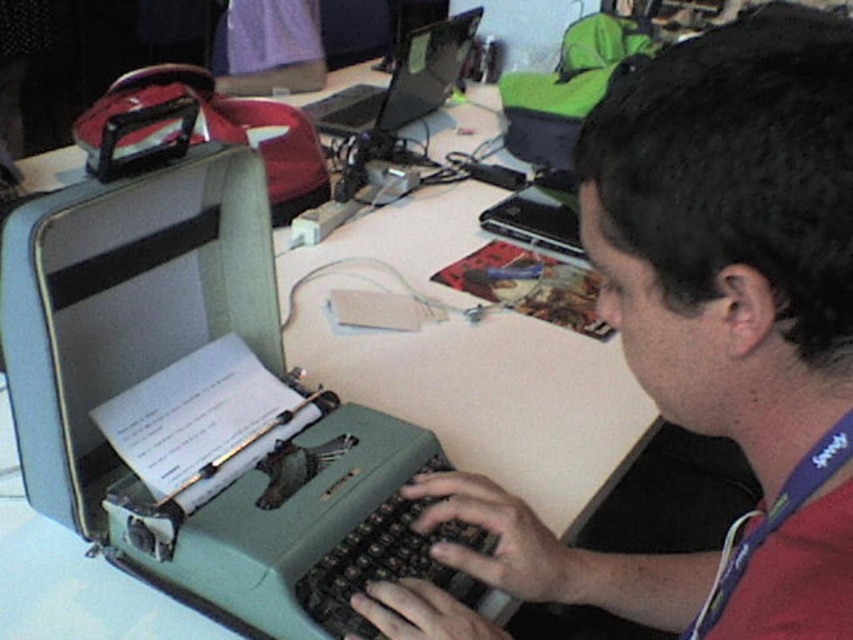
Is point (695, 348) positioned before point (529, 320)?

That is True.

Who is taller, matte green typewriter at center or white plastic table at center?

Standing taller between the two is white plastic table at center.

In order to click on matte green typewriter at center in this screenshot , I will do `click(715, 326)`.

The width and height of the screenshot is (853, 640). In order to click on matte green typewriter at center in this screenshot , I will do `click(715, 326)`.

Does white plastic table at center have a lesser width compared to black glossy laptop at upper center?

No.

Can you confirm if white plastic table at center is positioned above black glossy laptop at upper center?

Actually, white plastic table at center is below black glossy laptop at upper center.

Is point (280, 273) closer to camera compared to point (422, 51)?

Yes, point (280, 273) is closer to viewer.

Where is `white plastic table at center`? This screenshot has height=640, width=853. white plastic table at center is located at coordinates (469, 358).

Who is more distant from viewer, [691,392] or [386,115]?

Point [386,115]

Does matte green typewriter at center have a greater width compared to black glossy laptop at upper center?

No.

Does point (815, 20) come behind point (339, 128)?

No, (815, 20) is closer to viewer.

Locate an element on the screen. Image resolution: width=853 pixels, height=640 pixels. matte green typewriter at center is located at coordinates (715, 326).